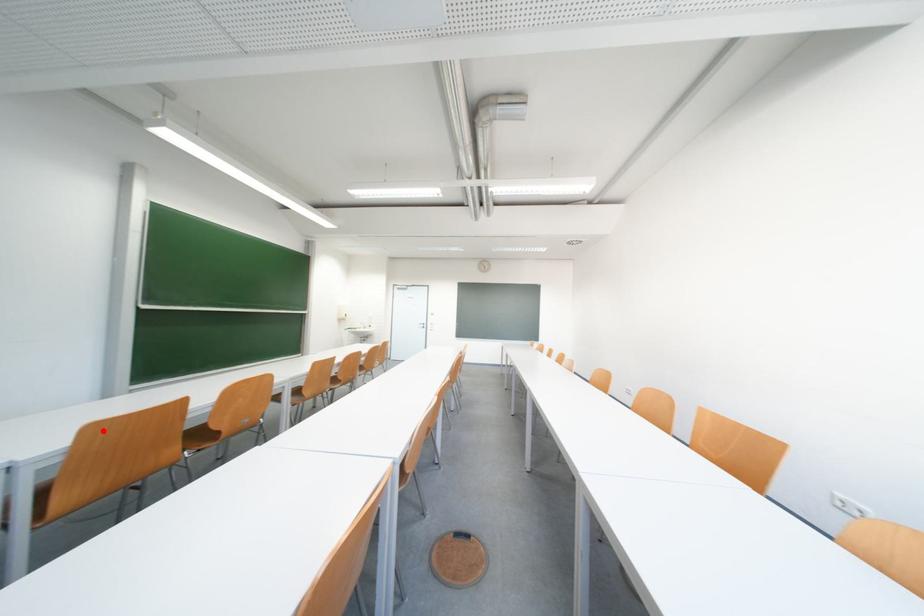
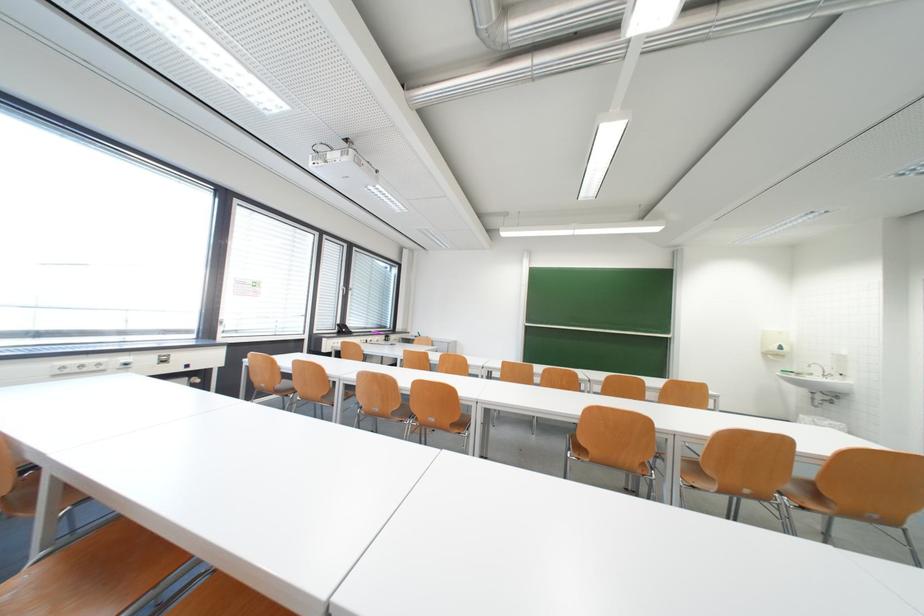
In the second image, find the point that corresponds to the highlighted location in the first image.

(414, 354)